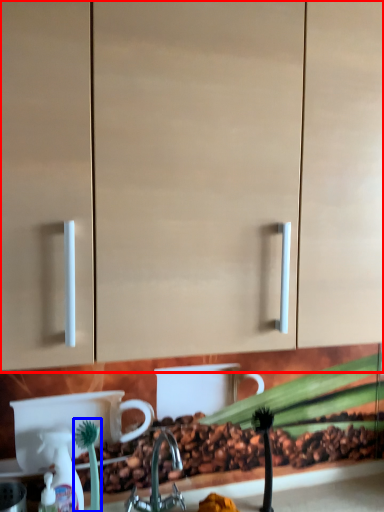
Question: Among these objects, which one is farthest to the camera, cabinetry (highlighted by a red box) or plant (highlighted by a blue box)?

Choices:
 (A) cabinetry
 (B) plant

Answer: (B)